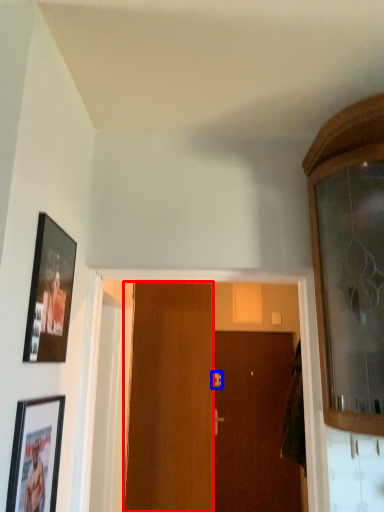
Question: Which object is closer to the camera taking this photo, door (highlighted by a red box) or door handle (highlighted by a blue box)?

Choices:
 (A) door
 (B) door handle

Answer: (A)